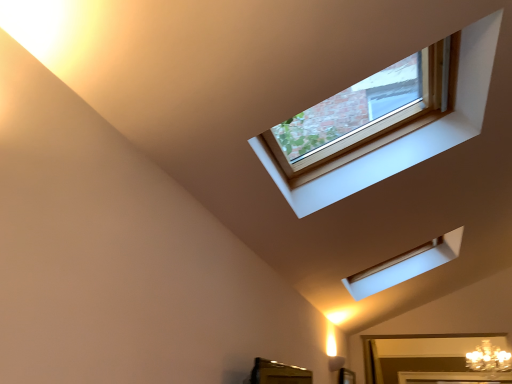
Question: Should I look upward or downward to see wooden frame window at upper center?

Choices:
 (A) down
 (B) up

Answer: (B)